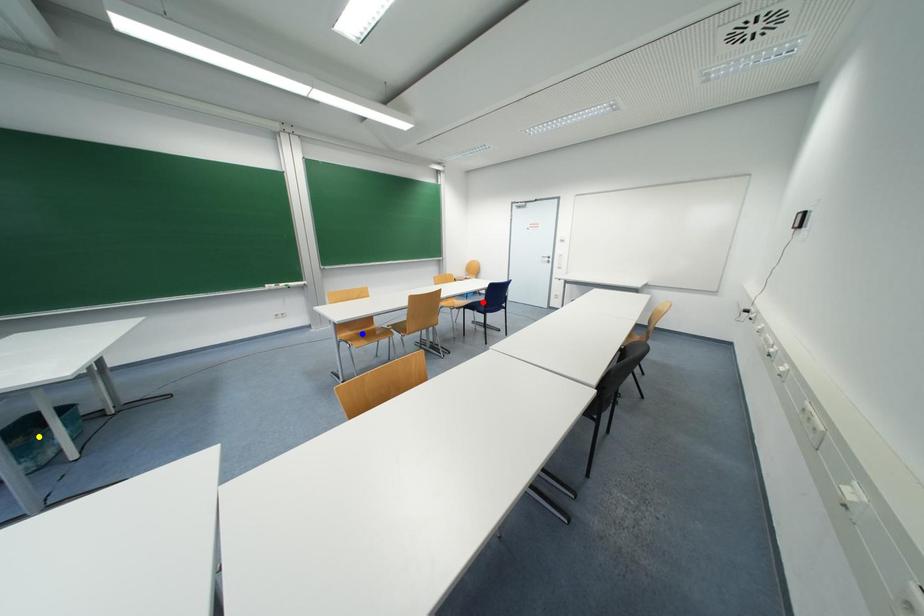
Order these from farthest to nearest:
yellow point
red point
blue point

red point
blue point
yellow point